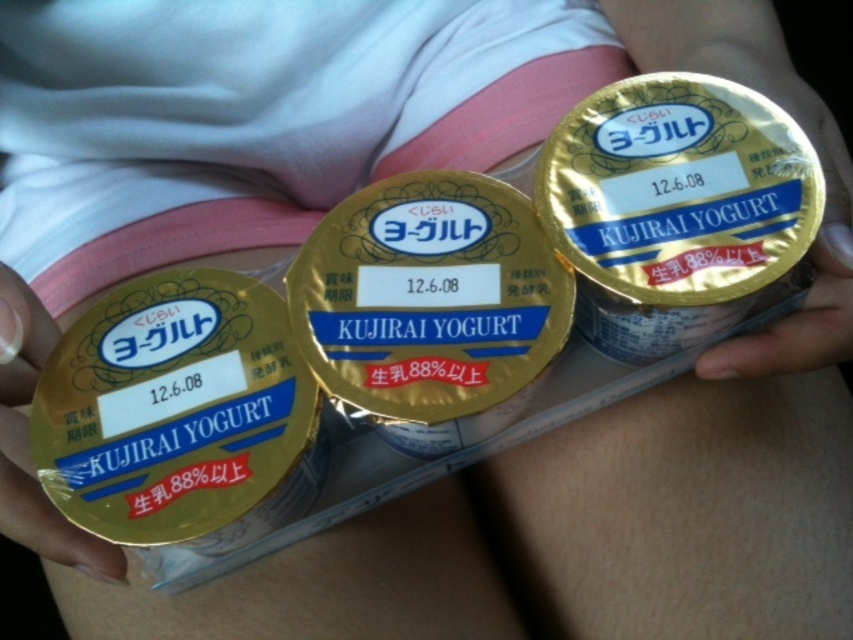
Who is taller, metallic gold yogurt container at upper right or gold foil yogurt container at center?

Standing taller between the two is metallic gold yogurt container at upper right.

In the scene shown: Does metallic gold yogurt container at upper right lie behind gold foil yogurt container at center?

Yes, metallic gold yogurt container at upper right is behind gold foil yogurt container at center.

Is point (819, 289) more distant than point (27, 355)?

Yes, it is behind point (27, 355).

Locate an element on the screen. metallic gold yogurt container at upper right is located at coordinates point(809,252).